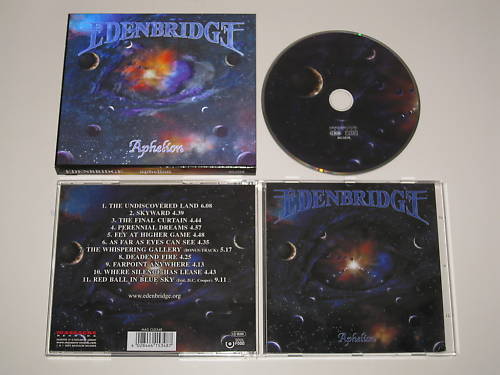
I want to click on cd case back, so click(194, 258).